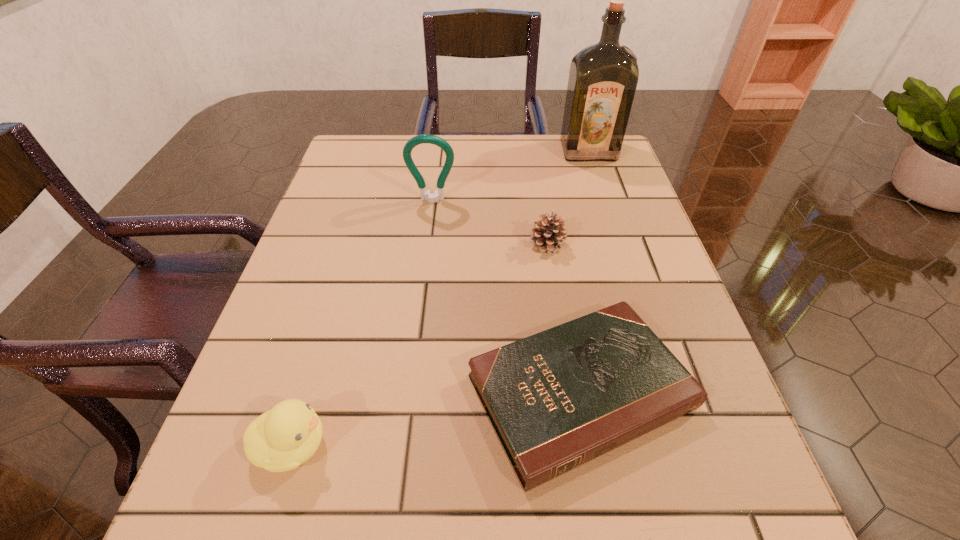
Identify the location of vacant area located at the beak of the duckling. (422, 446).

I want to click on vacant region located on the front of the fourth tallest object, so click(x=571, y=395).

Where is `free space located 0.130m on the back of the shortest object`? free space located 0.130m on the back of the shortest object is located at coordinates (558, 266).

Locate an element on the screen. Image resolution: width=960 pixels, height=540 pixels. object at the far edge is located at coordinates (603, 77).

What are the coordinates of `object that is at the near edge` in the screenshot? It's located at (558, 399).

This screenshot has width=960, height=540. Find the location of `object that is positioned at the left edge`. object that is positioned at the left edge is located at coordinates (281, 439).

The height and width of the screenshot is (540, 960). I want to click on liquor present at the right edge, so click(603, 77).

At what (x,y) coordinates should I click in order to perform the action: click on Bible that is at the right edge. Please return your answer as a coordinate pair (x, y). This screenshot has height=540, width=960. Looking at the image, I should click on (558, 399).

Image resolution: width=960 pixels, height=540 pixels. Identify the location of object present at the far right corner. (603, 77).

You are a GUI agent. You are given a task and a screenshot of the screen. Output one action in this format:
    pyautogui.click(x=<x>, y=<y>)
    Task: Click on the object at the near right corner
    
    Given the screenshot: What is the action you would take?
    pyautogui.click(x=558, y=399)